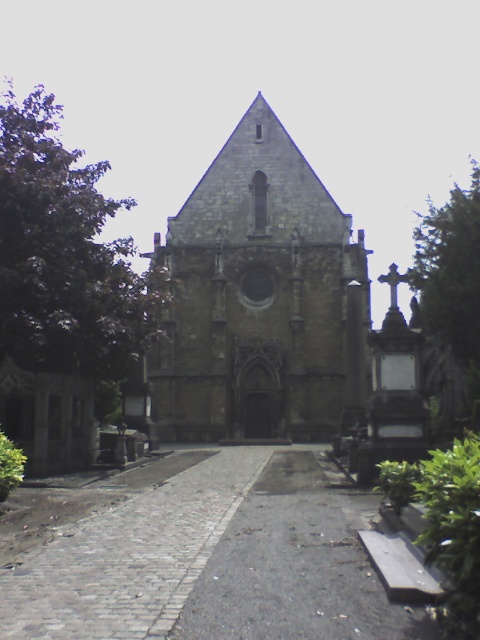
You are standing at the entrance of the Gothic church and want to walk towards the point labeled point (x=193, y=513). Will you pass by the point labeled point (x=208, y=240) on your way?

Yes, because point (x=193, y=513) is in front of point (x=208, y=240), so you will pass by point (x=208, y=240) on your way to point (x=193, y=513).

Based on the photo, you are a visitor approaching the stone gothic church at center. You want to walk up to the entrance. Is the cobblestone path at center wide enough for you to walk on comfortably?

The cobblestone path at center occupies less space than the stone gothic church at center, so it may be narrow but still passable for walking.